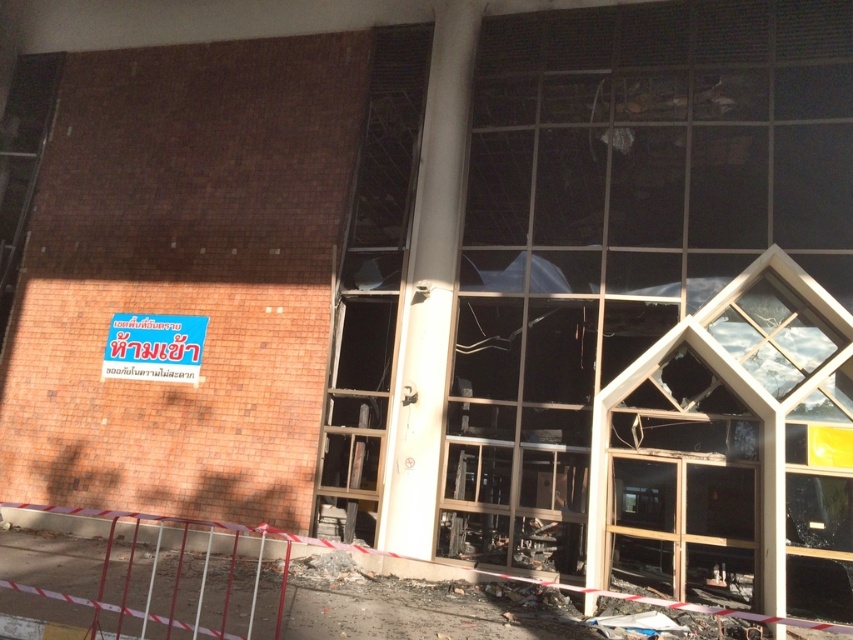
Looking at this image, you are a construction worker inspecting the damaged building. You need to determine which of the transparent glass window at right or transparent glass door at center requires immediate repair based on their size. Which one should you prioritize?

The transparent glass door at center should be prioritized for immediate repair because it is larger than the transparent glass window at right.

Based on the scene description, which object takes up more area in the image? Please compare the transparent glass window at right and the blue plastic sign at upper left.

The blue plastic sign at upper left occupies more area in the image than the transparent glass window at right.